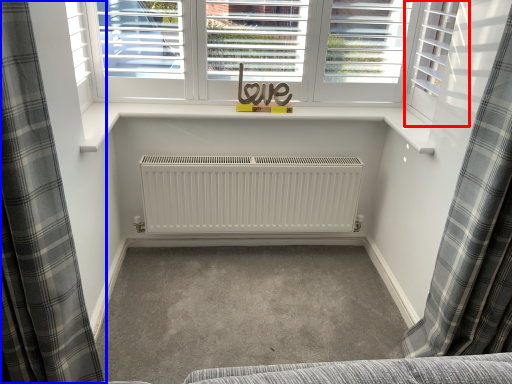
Question: Which point is further to the camera, shutter (highlighted by a red box) or curtain (highlighted by a blue box)?

Choices:
 (A) shutter
 (B) curtain

Answer: (A)